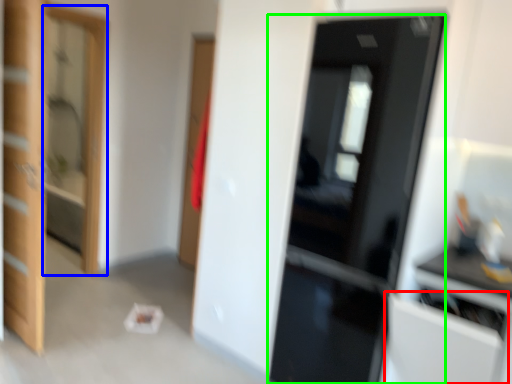
Question: Estimate the real-world distances between objects in this image. Which object is closer to cabinetry (highlighted by a red box), screen door (highlighted by a blue box) or door (highlighted by a green box)?

Choices:
 (A) screen door
 (B) door

Answer: (B)